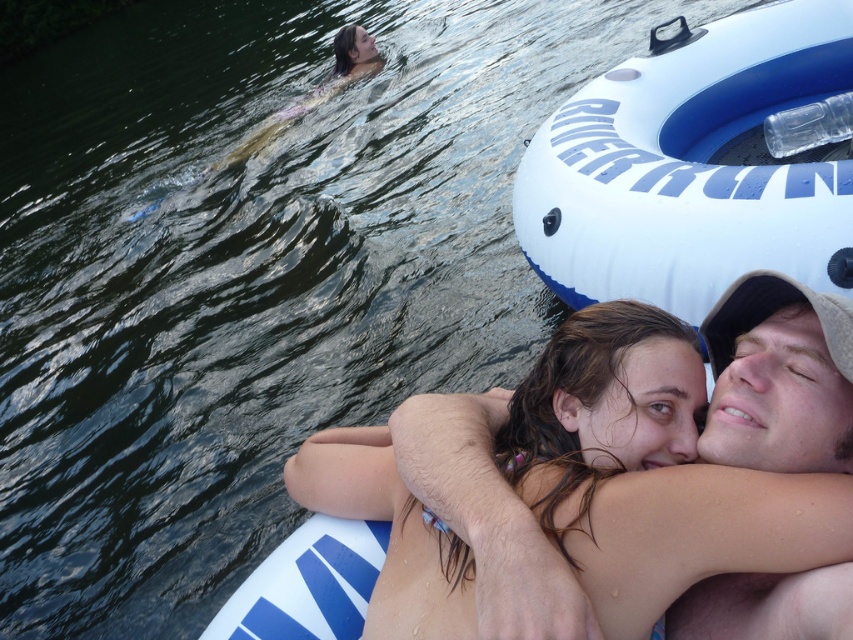
Question: Does smooth skin couple at center appear on the right side of smooth tan skin at center?

Choices:
 (A) yes
 (B) no

Answer: (B)

Question: Which is nearer to the smooth skin couple at center?

Choices:
 (A) white rubber ring at upper right
 (B) smooth tan skin at center

Answer: (B)

Question: Does white rubber ring at upper right have a larger size compared to smooth tan skin at center?

Choices:
 (A) yes
 (B) no

Answer: (A)

Question: Among these objects, which one is nearest to the camera?

Choices:
 (A) smooth skin couple at center
 (B) white rubber ring at upper right

Answer: (A)

Question: Is the position of smooth skin couple at center more distant than that of smooth tan skin at center?

Choices:
 (A) yes
 (B) no

Answer: (B)

Question: Which object is farther from the camera taking this photo?

Choices:
 (A) white rubber ring at upper right
 (B) smooth tan skin at center
 (C) smooth skin couple at center

Answer: (A)